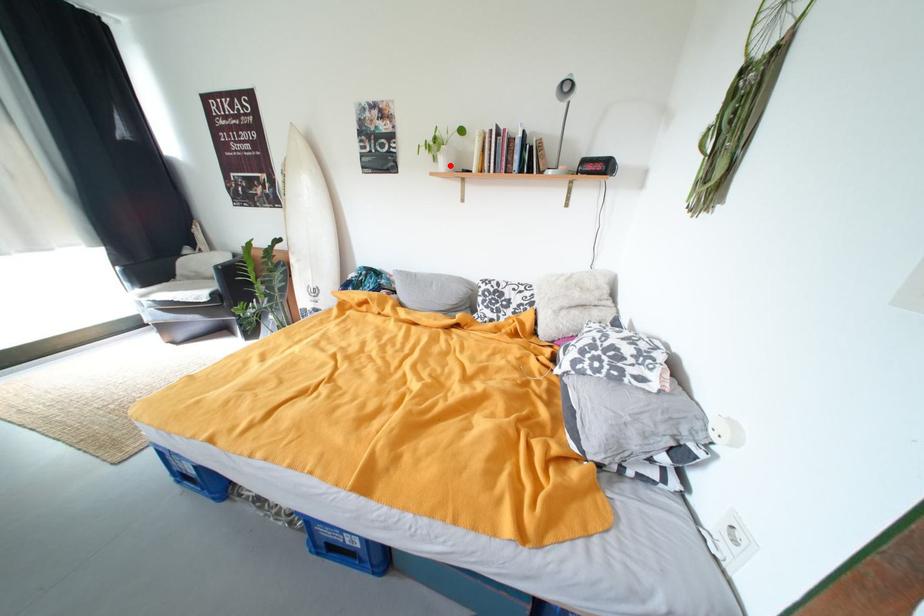
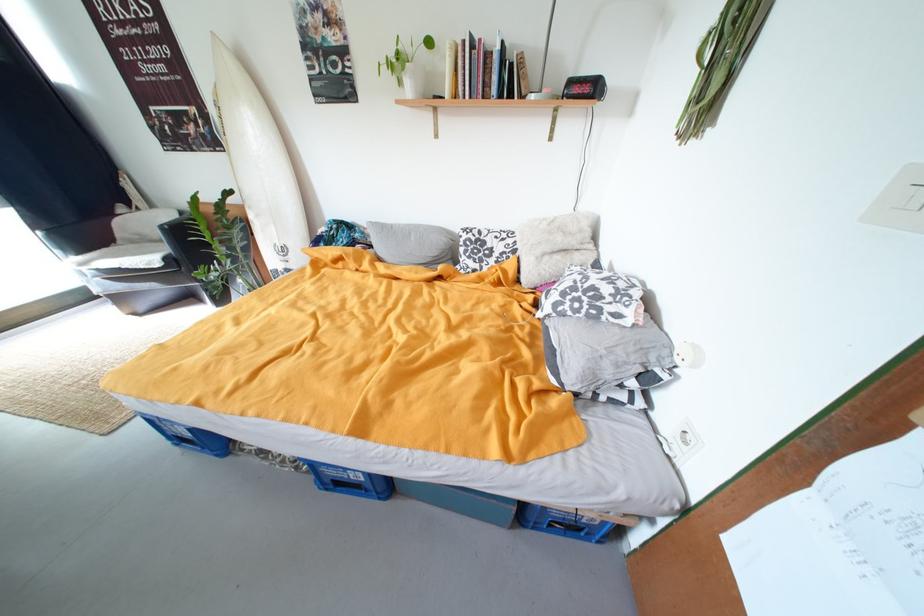
Where in the second image is the point corresponding to the highlighted location from the first image?

(418, 90)